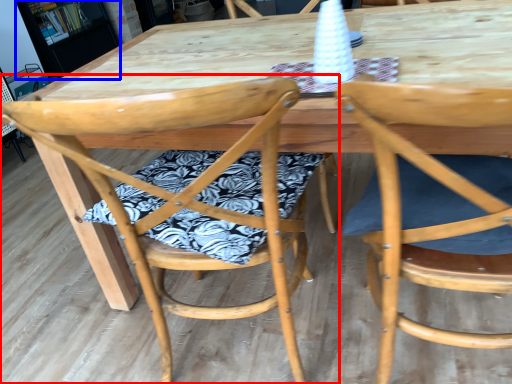
Question: Among these objects, which one is farthest to the camera, chair (highlighted by a red box) or bookshelf (highlighted by a blue box)?

Choices:
 (A) chair
 (B) bookshelf

Answer: (B)